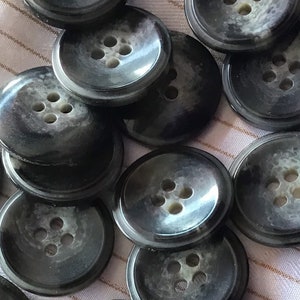
Image resolution: width=300 pixels, height=300 pixels. In order to click on brown part of fabric in this screenshot , I will do `click(263, 265)`.